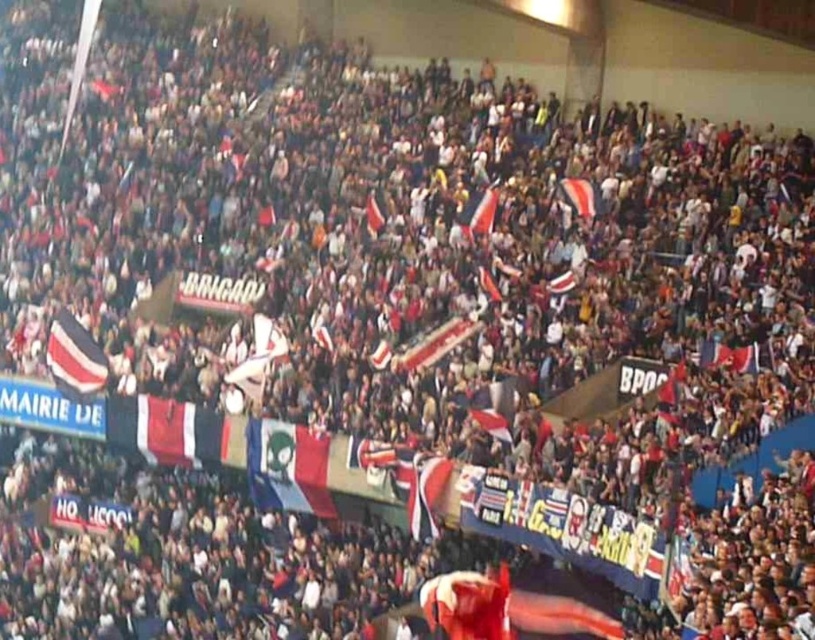
Question: Based on their relative distances, which object is nearer to the striped fabric flag at center?

Choices:
 (A) white fabric flag at center
 (B) tricolor fabric flag at center
 (C) striped fabric flag at upper center

Answer: (B)

Question: Observing the image, what is the correct spatial positioning of tricolor fabric flag at center in reference to white fabric flag at center?

Choices:
 (A) below
 (B) above

Answer: (A)

Question: Is striped fabric flag at center to the right of striped fabric flag at upper center from the viewer's perspective?

Choices:
 (A) no
 (B) yes

Answer: (A)

Question: Which of the following is the farthest from the observer?

Choices:
 (A) striped fabric flag at center
 (B) tricolor fabric flag at center
 (C) white fabric flag at center

Answer: (A)

Question: Which object is the farthest from the striped fabric flag at upper center?

Choices:
 (A) tricolor fabric flag at center
 (B) striped fabric flag at center
 (C) white fabric flag at center

Answer: (B)

Question: Does striped fabric flag at center appear on the left side of white fabric flag at center?

Choices:
 (A) no
 (B) yes

Answer: (B)